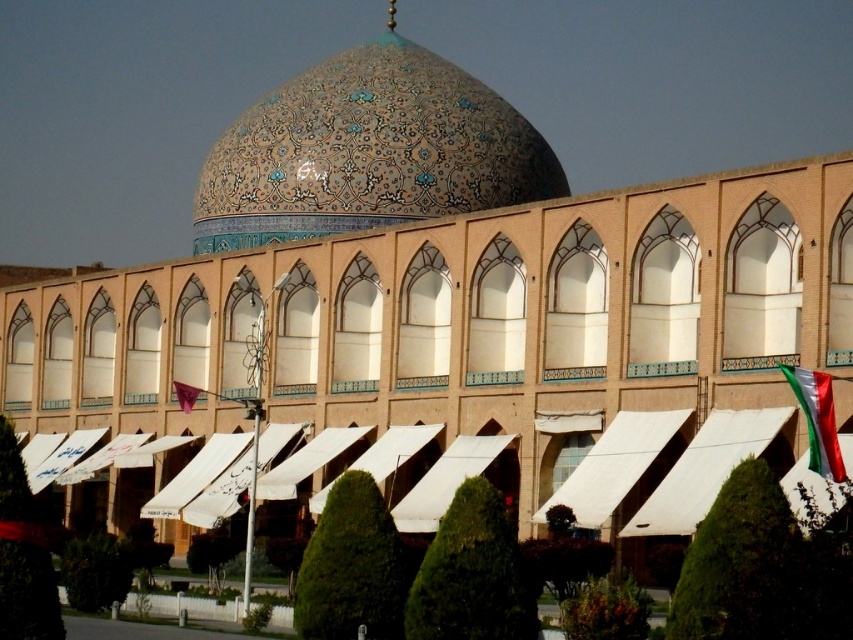
Looking at this image, you are standing in front of the mosque described in the scene. You notice a specific point marked at coordinates (367, 150). Based on the description, what architectural feature does this point most likely correspond to?

The point at coordinates (367, 150) corresponds to the glazed ceramic dome at center.

You are a tourist standing in front of the mosque and want to take a photo of the green and white fabric flag at lower right and the glazed ceramic dome at center. Which object will appear smaller in your photo?

The green and white fabric flag at lower right will appear smaller in your photo because it is positioned behind the glazed ceramic dome at center, making it farther away from the camera and thus appearing smaller.

You are standing in front of a mosque with a large dome and intricate arches. There is a point marked at coordinates (534, 173) in the image. If you want to reach that point, which is 98.47 meters away, would you need to walk towards the dome or away from it?

The point at coordinates (534, 173) is 98.47 meters away from the camera. Since the dome is the central feature of the mosque and the point is located at that distance, you would need to walk towards the dome to reach it.